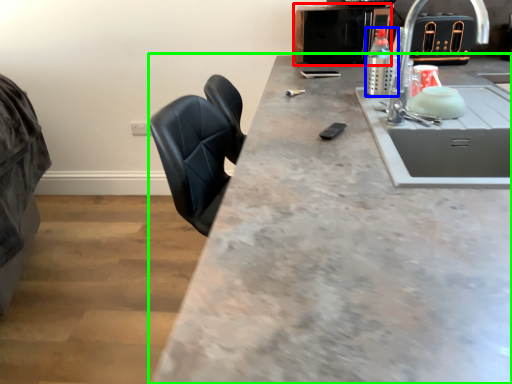
Question: Which object is the closest to the appliance (highlighted by a red box)? Choose among these: bottle (highlighted by a blue box) or countertop (highlighted by a green box).

Choices:
 (A) bottle
 (B) countertop

Answer: (A)